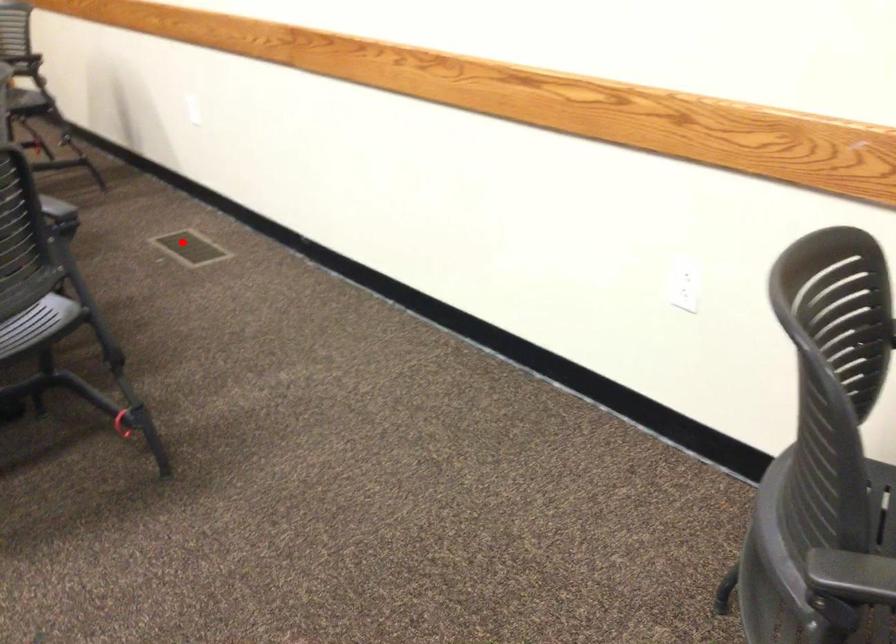
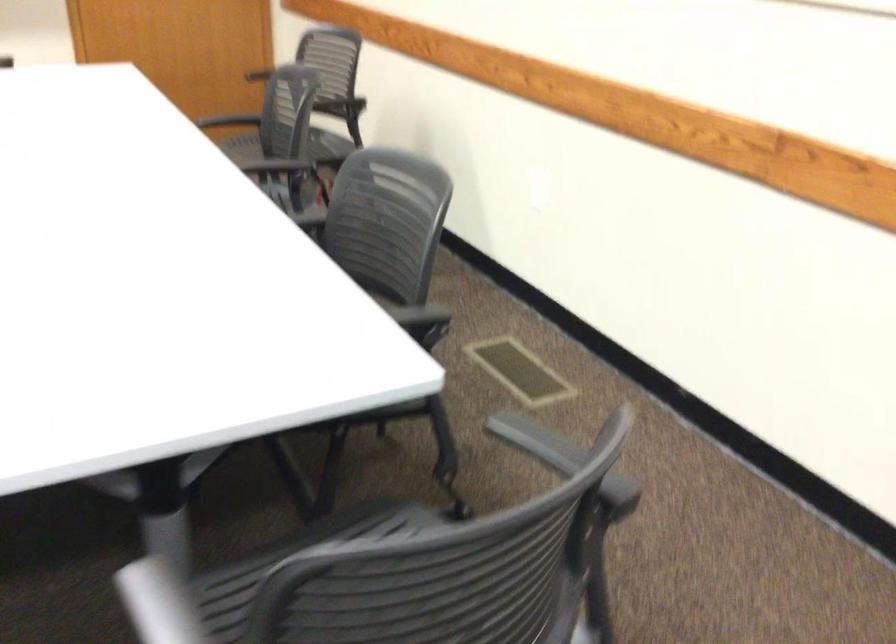
Question: A red point is marked in image1. In image2, is the corresponding 3D point closer to the camera or farther? Reply with the corresponding letter.

Choices:
 (A) The corresponding 3D point is closer.
 (B) The corresponding 3D point is farther.

Answer: (A)